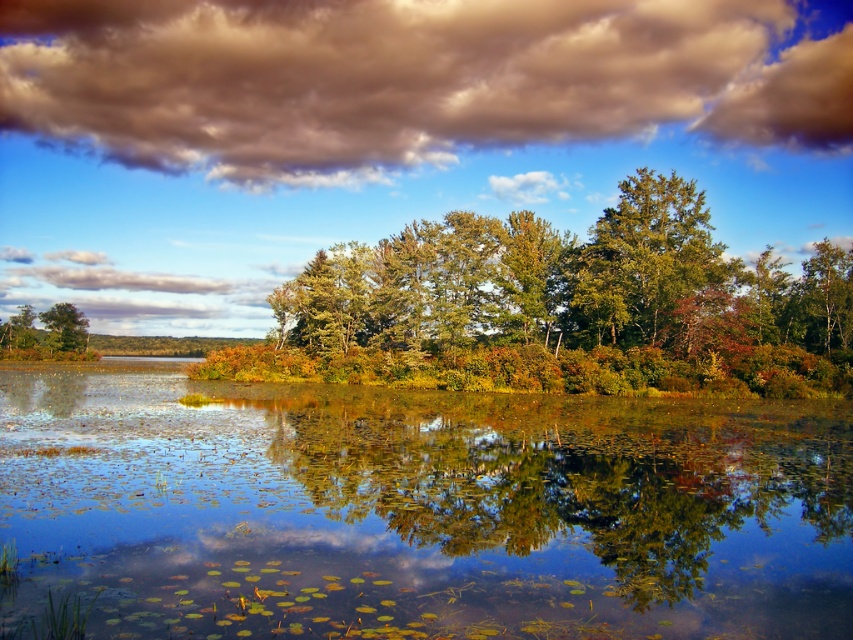
Question: Among these objects, which one is farthest from the camera?

Choices:
 (A) green leafy trees at center
 (B) cloudy sky at upper center
 (C) green matte tree at left

Answer: (B)

Question: Is green leafy water at center to the right of green matte tree at left from the viewer's perspective?

Choices:
 (A) no
 (B) yes

Answer: (B)

Question: Does cloudy sky at upper center have a smaller size compared to green leafy trees at center?

Choices:
 (A) yes
 (B) no

Answer: (B)

Question: Based on their relative distances, which object is nearer to the green leafy water at center?

Choices:
 (A) green matte tree at left
 (B) green matte tree at upper right
 (C) green leafy trees at center
 (D) cloudy sky at upper center

Answer: (C)

Question: Which of the following is the closest to the observer?

Choices:
 (A) (141, 483)
 (B) (541, 241)

Answer: (A)

Question: Is green leafy trees at center further to the viewer compared to green matte tree at left?

Choices:
 (A) no
 (B) yes

Answer: (A)